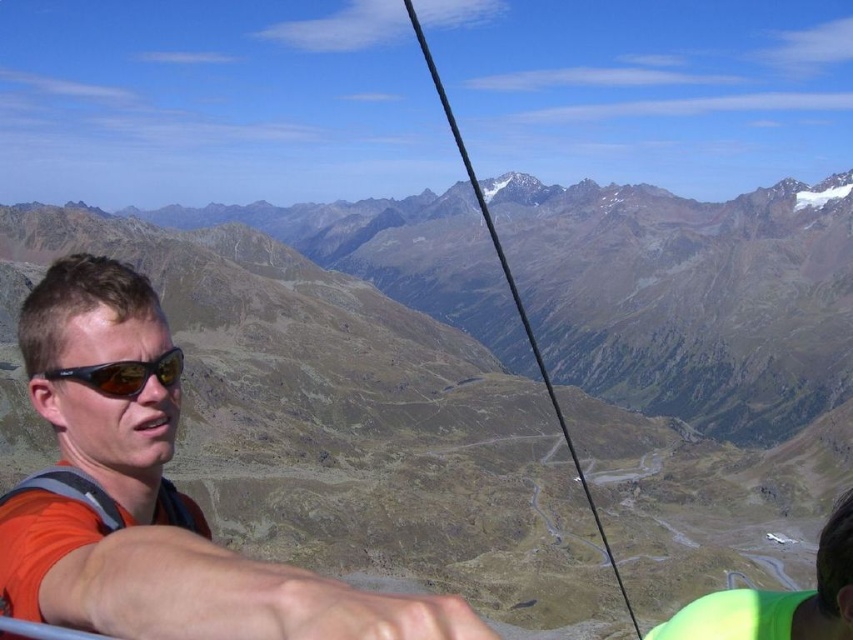
Question: Which point is closer to the camera taking this photo?

Choices:
 (A) click(811, 422)
 (B) click(171, 362)
 (C) click(136, 632)

Answer: (C)

Question: Which point is farther to the camera?

Choices:
 (A) (125, 381)
 (B) (375, 378)
 (C) (242, 573)

Answer: (B)

Question: Which point is closer to the camera taking this photo?

Choices:
 (A) (7, 365)
 (B) (173, 352)

Answer: (B)

Question: Can you confirm if brown rocky mountain at center is bigger than orange fabric shirt at center?

Choices:
 (A) no
 (B) yes

Answer: (B)

Question: Is brown rocky mountain at center closer to the viewer compared to matte black goggles at left?

Choices:
 (A) no
 (B) yes

Answer: (A)

Question: Does brown rocky mountain at center appear on the right side of matte black goggles at left?

Choices:
 (A) yes
 (B) no

Answer: (A)